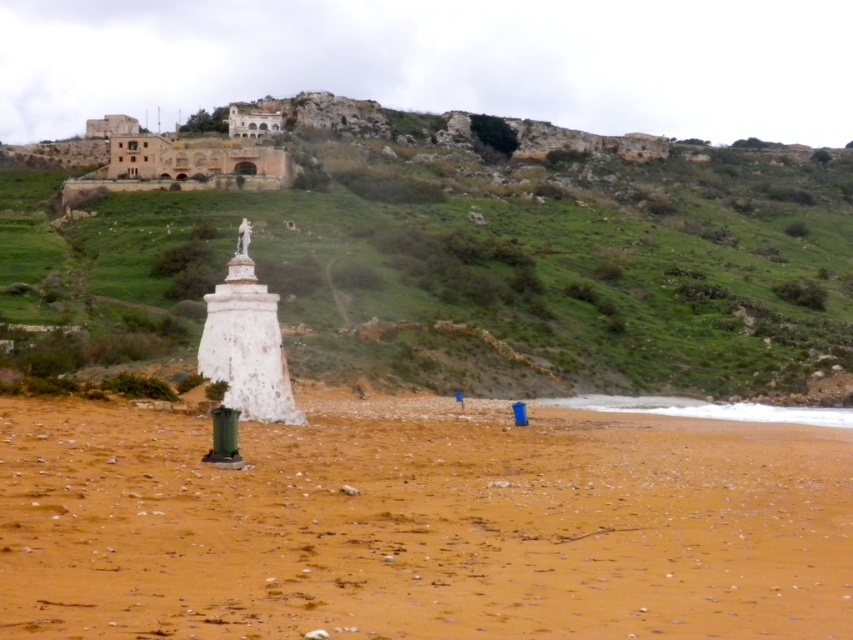
Question: Can you confirm if green grassy hillside at upper center is thinner than brown sandy beach at lower center?

Choices:
 (A) yes
 (B) no

Answer: (B)

Question: Is the position of green grassy hillside at upper center less distant than that of brown sandy beach at lower center?

Choices:
 (A) no
 (B) yes

Answer: (A)

Question: Does green grassy hillside at upper center appear on the right side of brown sandy beach at lower center?

Choices:
 (A) no
 (B) yes

Answer: (A)

Question: Which object appears closest to the camera in this image?

Choices:
 (A) brown sandy beach at lower center
 (B) green grassy hillside at upper center

Answer: (A)